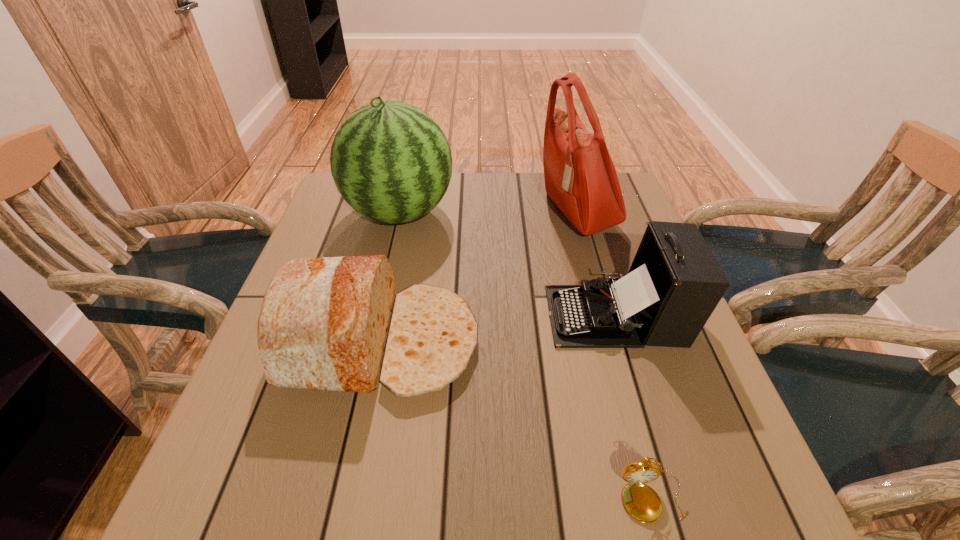
Select which object is the fourth closest to the watermelon. Please provide its 2D coordinates. Your answer should be formatted as a tuple, i.e. [(x, y)], where the tuple contains the x and y coordinates of a point satisfying the conditions above.

[(641, 501)]

What are the coordinates of `the third closest object to the bread` in the screenshot? It's located at 580,177.

Locate an element on the screen. The width and height of the screenshot is (960, 540). vacant space that satisfies the following two spatial constraints: 1. on the front-facing side of the handbag; 2. on the face of the pocket watch is located at coordinates (656, 497).